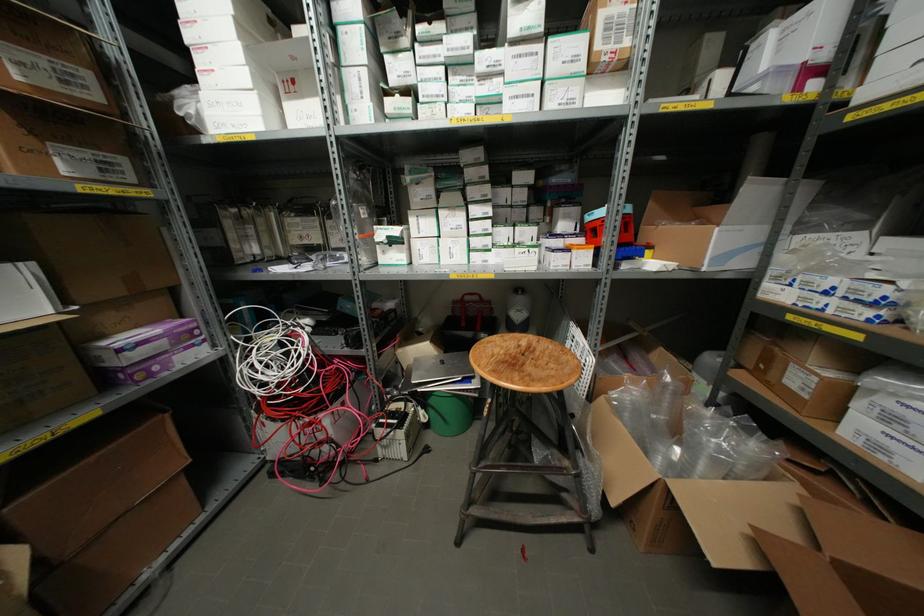
You are a GUI agent. You are given a task and a screenshot of the screen. Output one action in this format:
    pyautogui.click(x=<x>, y=<y>)
    Task: Click on the purple rectangular box
    This screenshot has height=616, width=924.
    Given the screenshot: What is the action you would take?
    pyautogui.click(x=146, y=351)